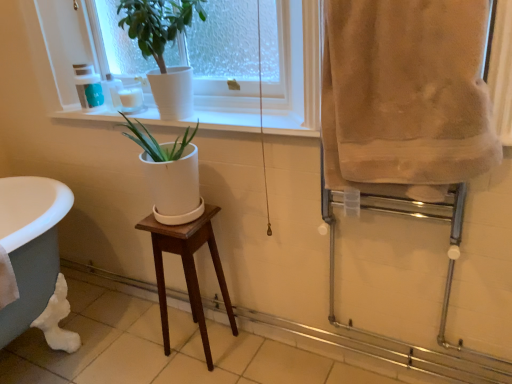
Question: Is matte green plastic cup at upper left, placed as the 2th toiletry when sorted from right to left, not close to white ceramic pot at upper center?

Choices:
 (A) no
 (B) yes

Answer: (A)

Question: Considering the relative sizes of matte green plastic cup at upper left, the first toiletry positioned from the left, and white ceramic pot at upper center in the image provided, is matte green plastic cup at upper left, the first toiletry positioned from the left, taller than white ceramic pot at upper center?

Choices:
 (A) yes
 (B) no

Answer: (B)

Question: From a real-world perspective, is matte green plastic cup at upper left, placed as the 2th toiletry when sorted from right to left, located beneath white ceramic pot at upper center?

Choices:
 (A) yes
 (B) no

Answer: (A)

Question: Would you say white ceramic pot at upper center is part of matte green plastic cup at upper left, the first toiletry positioned from the left,'s contents?

Choices:
 (A) yes
 (B) no

Answer: (B)

Question: Is matte green plastic cup at upper left, placed as the 2th toiletry when sorted from right to left, looking in the opposite direction of white ceramic pot at upper center?

Choices:
 (A) no
 (B) yes

Answer: (A)

Question: Is white ceramic pot at upper center taller or shorter than beige soft towel at right?

Choices:
 (A) tall
 (B) short

Answer: (B)

Question: From the image's perspective, is white ceramic pot at upper center above or below beige soft towel at right?

Choices:
 (A) above
 (B) below

Answer: (A)

Question: Visually, is white ceramic pot at upper center positioned to the left or to the right of beige soft towel at right?

Choices:
 (A) left
 (B) right

Answer: (A)

Question: Looking at their shapes, would you say white ceramic pot at upper center is wider or thinner than beige soft towel at right?

Choices:
 (A) wide
 (B) thin

Answer: (A)

Question: Is white ceramic pot at upper center inside the boundaries of white ceramic at upper center, or outside?

Choices:
 (A) inside
 (B) outside

Answer: (B)

Question: Considering the positions of white ceramic pot at upper center and white ceramic at upper center in the image, is white ceramic pot at upper center bigger or smaller than white ceramic at upper center?

Choices:
 (A) big
 (B) small

Answer: (A)

Question: From a real-world perspective, relative to white ceramic at upper center, is white ceramic pot at upper center vertically above or below?

Choices:
 (A) below
 (B) above

Answer: (B)

Question: In terms of height, does white ceramic pot at upper center look taller or shorter compared to white ceramic at upper center?

Choices:
 (A) tall
 (B) short

Answer: (A)

Question: Is beige soft towel at right in front of or behind matte green plastic cup at upper left, the first toiletry positioned from the left, in the image?

Choices:
 (A) front
 (B) behind

Answer: (A)

Question: From the image's perspective, is beige soft towel at right above or below matte green plastic cup at upper left, placed as the 2th toiletry when sorted from right to left?

Choices:
 (A) below
 (B) above

Answer: (A)